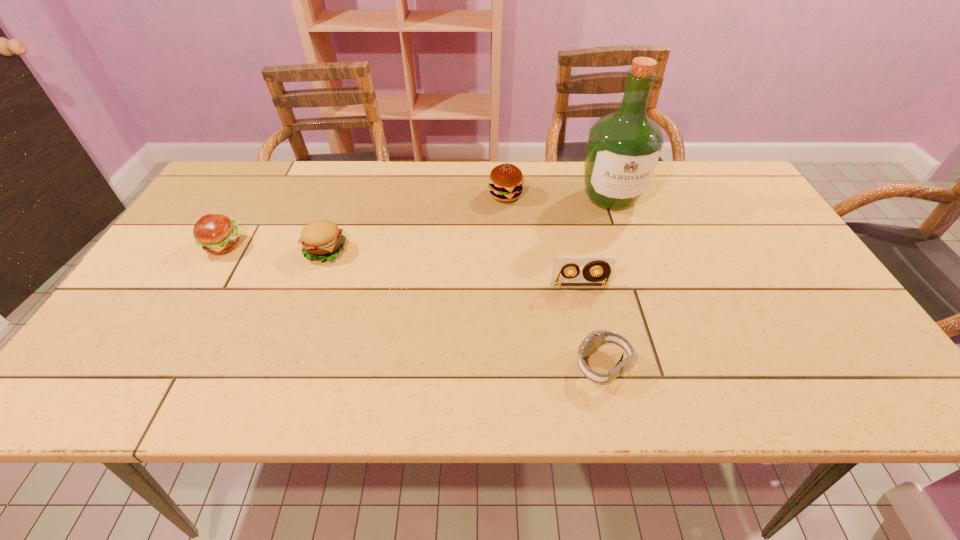
This screenshot has height=540, width=960. I want to click on vacant space located on the front of the leftmost object, so click(x=178, y=321).

At what (x,y) coordinates should I click in order to perform the action: click on free region located 0.160m on the front of the second hamburger from left to right. Please return your answer as a coordinate pair (x, y). Looking at the image, I should click on (302, 314).

Locate an element on the screen. This screenshot has width=960, height=540. blank space located on the face of the watch is located at coordinates (552, 366).

At what (x,y) coordinates should I click in order to perform the action: click on free spot located 0.230m on the face of the watch. Please return your answer as a coordinate pair (x, y). The height and width of the screenshot is (540, 960). Looking at the image, I should click on (465, 366).

You are a GUI agent. You are given a task and a screenshot of the screen. Output one action in this format:
    pyautogui.click(x=<x>, y=<y>)
    Task: Click on the free space located 0.180m on the face of the watch
    The width and height of the screenshot is (960, 540).
    Given the screenshot: What is the action you would take?
    pyautogui.click(x=489, y=366)

The width and height of the screenshot is (960, 540). Find the location of `liquor that is positioned at the far edge`. liquor that is positioned at the far edge is located at coordinates (623, 150).

This screenshot has height=540, width=960. I want to click on hamburger located at the far edge, so click(505, 184).

The image size is (960, 540). Identify the location of object at the near edge. (596, 339).

In order to click on object located in the left edge section of the desktop in this screenshot , I will do `click(217, 234)`.

In the image, there is a desktop. Identify the location of vacant space at the far edge. Image resolution: width=960 pixels, height=540 pixels. (519, 163).